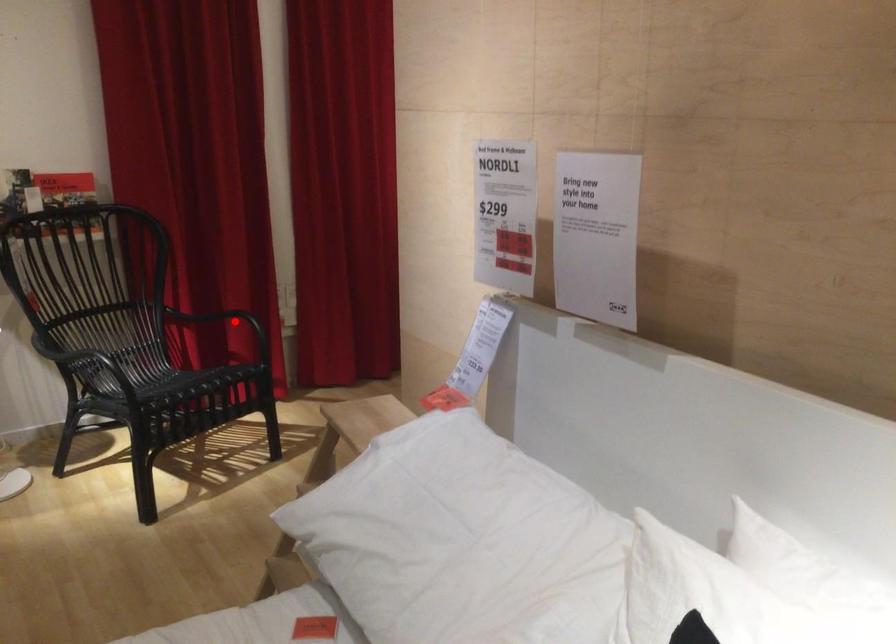
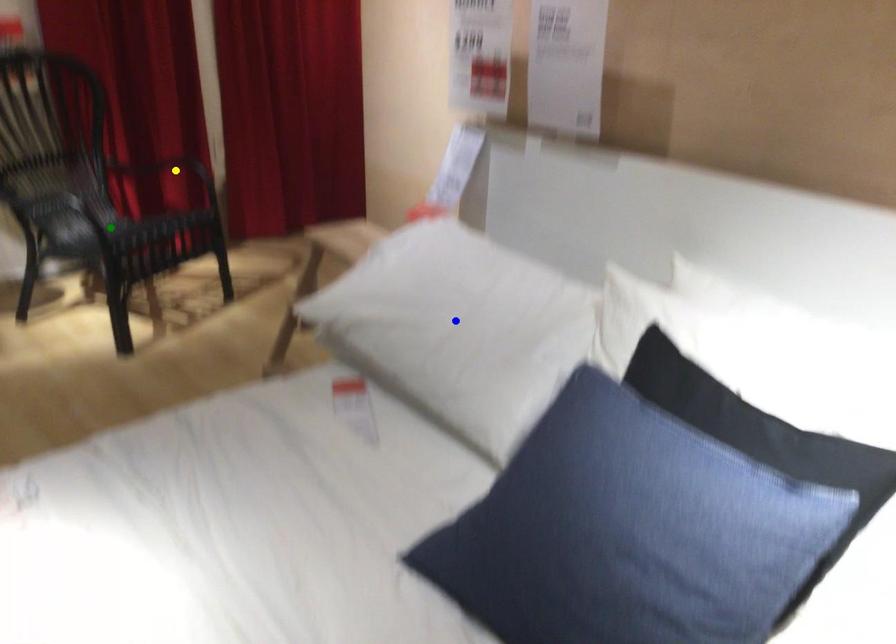
Question: I am providing you with two images of the same scene from different viewpoints. A red point is marked on the first image. You are given multiple points on the second image. In image 2, which mark is for the same physical point as the one in image 1?

Choices:
 (A) yellow point
 (B) green point
 (C) blue point

Answer: (A)